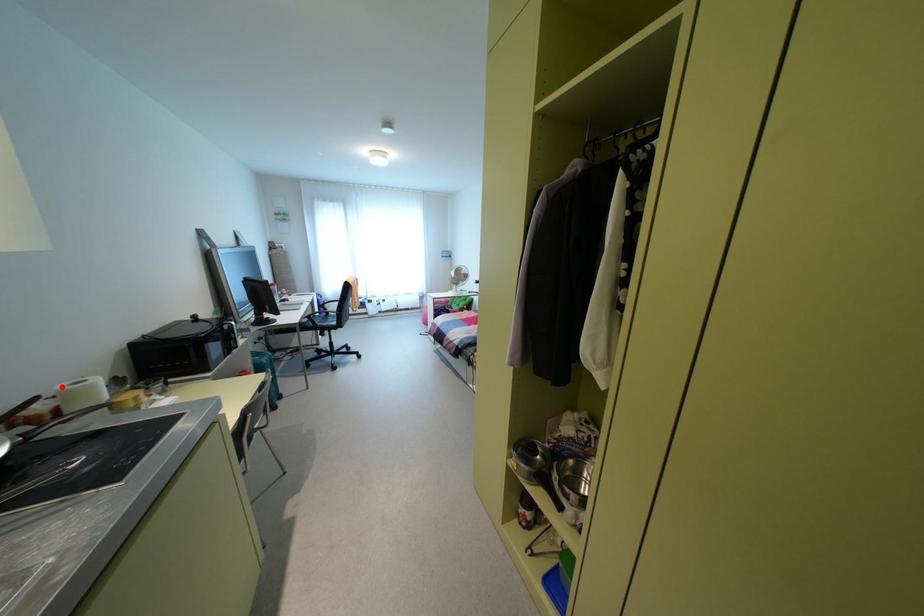
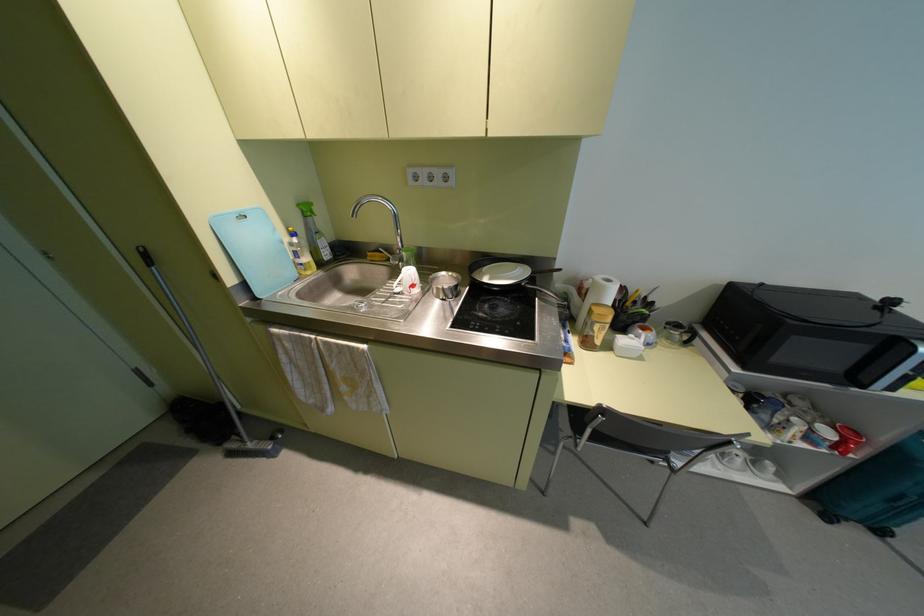
Question: I am providing you with two images of the same scene from different viewpoints. Image1 has a red point marked. In image2, the corresponding 3D location appears at what relative position? Reply with the corresponding letter.

Choices:
 (A) Closer
 (B) Farther

Answer: (A)